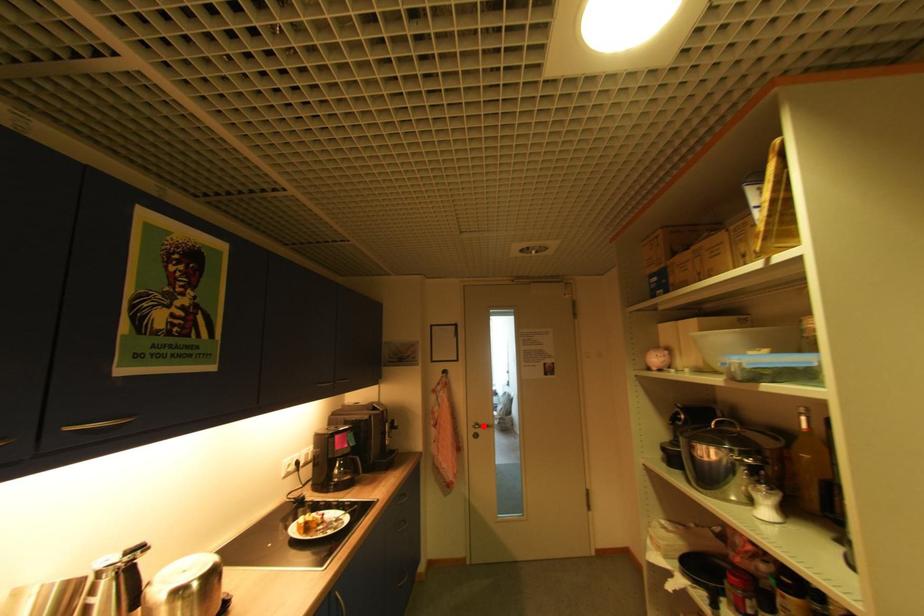
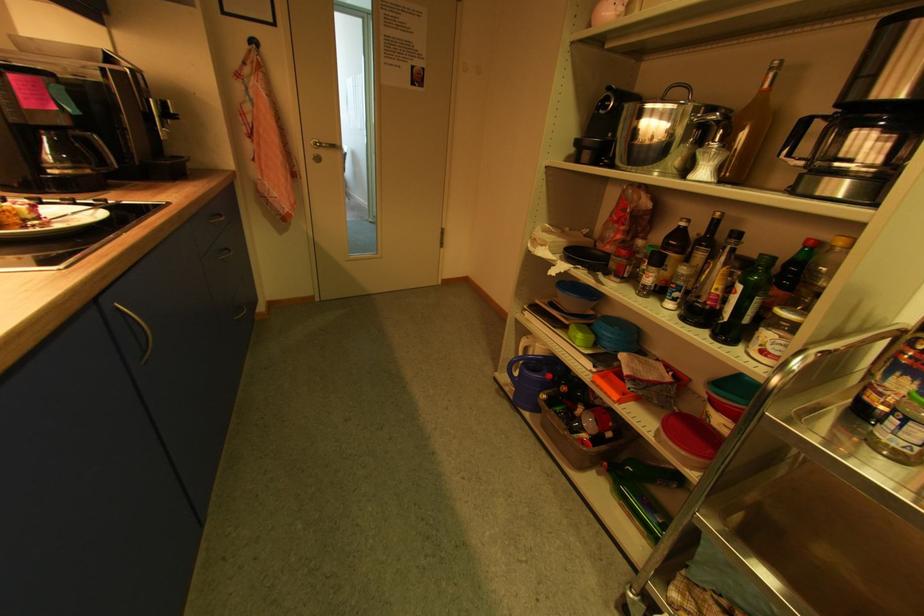
In the second image, find the point that corresponds to the highlighted location in the first image.

(323, 146)